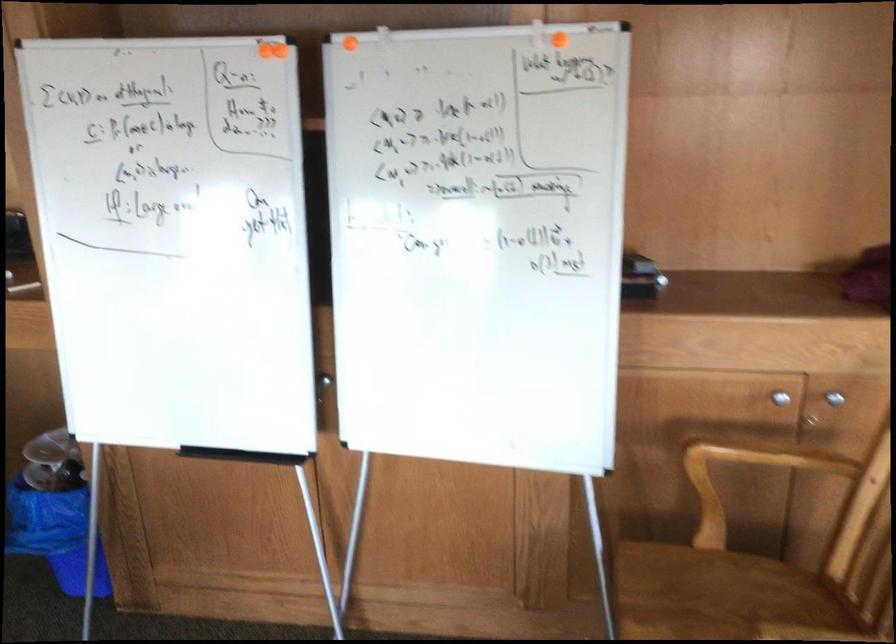
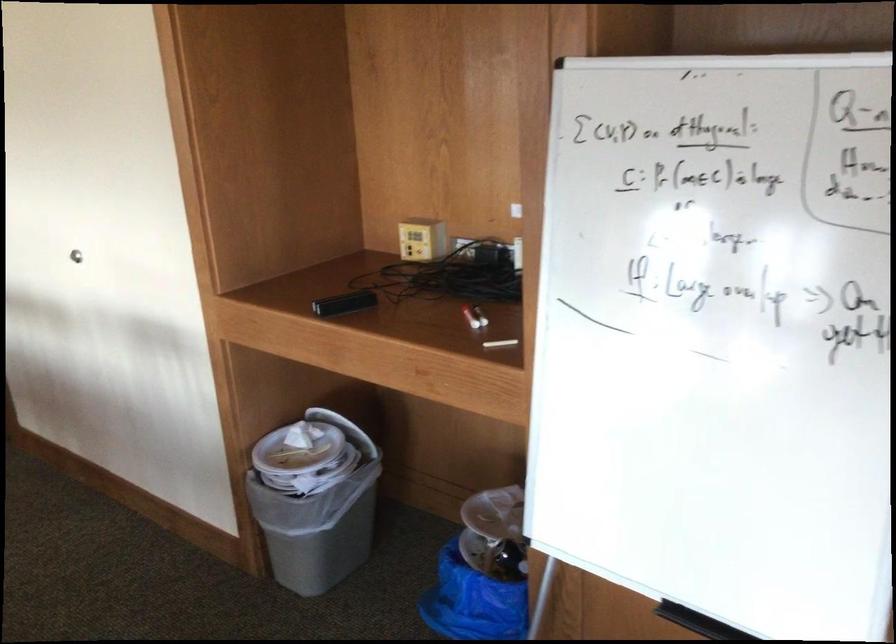
Question: How did the camera likely rotate?

Choices:
 (A) Left
 (B) Right
 (C) Up
 (D) Down

Answer: (A)